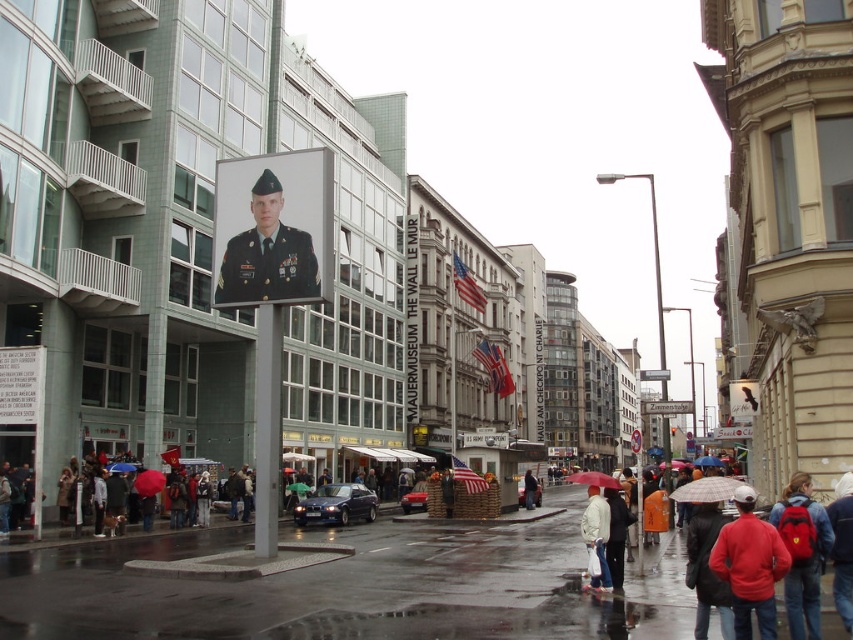
Question: Which is farther from the white matte jacket at lower right?

Choices:
 (A) shiny red car at center
 (B) red matte jacket at lower right
 (C) shiny dark blue sedan at center

Answer: (A)

Question: Which point appears farthest from the camera in this image?

Choices:
 (A) (816, 604)
 (B) (183, 538)
 (C) (422, 500)

Answer: (C)

Question: Does green military uniform at center have a larger size compared to red backpack at lower right?

Choices:
 (A) yes
 (B) no

Answer: (B)

Question: Which point is closer to the camera taking this photo?

Choices:
 (A) (735, 545)
 (B) (263, 218)
 (C) (354, 499)
 (D) (817, 508)

Answer: (A)

Question: Does red matte umbrella at center appear over matte black uniform at center?

Choices:
 (A) yes
 (B) no

Answer: (B)

Question: Is white matte jacket at lower right smaller than red matte umbrella at center?

Choices:
 (A) yes
 (B) no

Answer: (A)